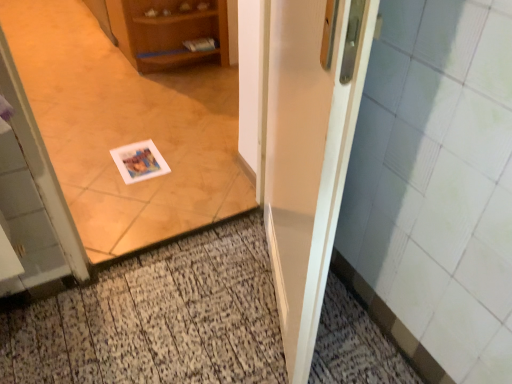
Find the location of a particular element. white paper at center is located at coordinates (126, 129).

Identify the location of white paper at center. (126, 129).

Visually, is white paper at center positioned to the left or to the right of white paper postcard at center?

Based on their positions, white paper at center is located to the right of white paper postcard at center.

Is white paper at center positioned with its back to white paper postcard at center?

Yes, white paper at center is facing away from white paper postcard at center.

Is there a large distance between white paper at center and white paper postcard at center?

white paper at center is actually quite close to white paper postcard at center.

Is white paper at center not within white paper postcard at center?

Yes, white paper at center is located beyond the bounds of white paper postcard at center.

Is the surface of white glossy door at center in direct contact with wooden cabinet at upper left?

No, white glossy door at center is not with wooden cabinet at upper left.

Which object is closer to the camera taking this photo, white glossy door at center or wooden cabinet at upper left?

white glossy door at center.

Who is smaller, white glossy door at center or wooden cabinet at upper left?

Smaller between the two is white glossy door at center.

Does point (296, 29) come closer to viewer compared to point (226, 56)?

Yes.

Are wooden cabinet at upper left and white paper postcard at center beside each other?

No, wooden cabinet at upper left is not making contact with white paper postcard at center.

From the image's perspective, which object appears higher, wooden cabinet at upper left or white paper postcard at center?

wooden cabinet at upper left, from the image's perspective.

Could you tell me if wooden cabinet at upper left is facing white paper postcard at center?

No, wooden cabinet at upper left is not oriented towards white paper postcard at center.

Consider the image. Is wooden cabinet at upper left wider or thinner than white paper postcard at center?

Clearly, wooden cabinet at upper left has more width compared to white paper postcard at center.

Who is smaller, wooden cabinet at upper left or white paper at center?

Smaller between the two is white paper at center.

Measure the distance between wooden cabinet at upper left and white paper at center.

wooden cabinet at upper left and white paper at center are 16.34 inches apart.

Could you tell me if wooden cabinet at upper left is facing white paper at center?

No, wooden cabinet at upper left does not turn towards white paper at center.

Between wooden cabinet at upper left and white paper at center, which one has larger width?

With larger width is wooden cabinet at upper left.

From the image's perspective, is white paper postcard at center below white glossy door at center?

Actually, white paper postcard at center appears above white glossy door at center in the image.

Is white paper postcard at center inside the boundaries of white glossy door at center, or outside?

white paper postcard at center exists outside the volume of white glossy door at center.

From a real-world perspective, between white paper postcard at center and white glossy door at center, who is vertically higher?

In real-world perspective, white glossy door at center is above.

Locate an element on the screen. door below the wooden cabinet at upper left (from the image's perspective) is located at coordinates (310, 152).

From a real-world perspective, is wooden cabinet at upper left positioned above or below white glossy door at center?

wooden cabinet at upper left is situated lower than white glossy door at center in the real world.

Is the surface of wooden cabinet at upper left in direct contact with white glossy door at center?

No, wooden cabinet at upper left is not in contact with white glossy door at center.

Is wooden cabinet at upper left wider than white glossy door at center?

Yes, wooden cabinet at upper left is wider than white glossy door at center.

I want to click on door above the white paper postcard at center (from a real-world perspective), so pos(310,152).

Looking at their sizes, would you say white glossy door at center is wider or thinner than white paper postcard at center?

white glossy door at center is thinner than white paper postcard at center.

Is the surface of white glossy door at center in direct contact with white paper postcard at center?

white glossy door at center is not next to white paper postcard at center, and they're not touching.

Is white glossy door at center looking in the opposite direction of white paper postcard at center?

white glossy door at center does not have its back to white paper postcard at center.

This screenshot has width=512, height=384. Find the location of `postcard that is above the white paper at center (from the image's perspective)`. postcard that is above the white paper at center (from the image's perspective) is located at coordinates (139, 161).

In order to click on door on the right of the wooden cabinet at upper left in this screenshot , I will do `click(310, 152)`.

Estimate the real-world distances between objects in this image. Which object is further from white paper postcard at center, white paper at center or wooden cabinet at upper left?

The object further to white paper postcard at center is wooden cabinet at upper left.

Looking at the image, which one is located closer to wooden cabinet at upper left, white paper postcard at center or white glossy door at center?

white paper postcard at center is positioned closer to the anchor wooden cabinet at upper left.

From the image, which object appears to be farther from white paper at center, wooden cabinet at upper left or white glossy door at center?

white glossy door at center lies further to white paper at center than the other object.

Considering their positions, is white glossy door at center positioned closer to white paper at center than wooden cabinet at upper left?

The object closer to white paper at center is wooden cabinet at upper left.

Based on their spatial positions, is white glossy door at center or wooden cabinet at upper left closer to white paper postcard at center?

wooden cabinet at upper left.

From the image, which object appears to be nearer to white glossy door at center, white paper at center or white paper postcard at center?

white paper at center lies closer to white glossy door at center than the other object.

In the scene shown: Considering their positions, is white paper postcard at center positioned closer to white glossy door at center than white paper at center?

white paper at center is closer to white glossy door at center.

When comparing their distances from wooden cabinet at upper left, does white paper postcard at center or white paper at center seem closer?

white paper at center is closer to wooden cabinet at upper left.

You are a GUI agent. You are given a task and a screenshot of the screen. Output one action in this format:
    pyautogui.click(x=<x>, y=<y>)
    Task: Click on the postcard between white glossy door at center and wooden cabinet at upper left from front to back
    
    Given the screenshot: What is the action you would take?
    pyautogui.click(x=139, y=161)

You are a GUI agent. You are given a task and a screenshot of the screen. Output one action in this format:
    pyautogui.click(x=<x>, y=<y>)
    Task: Click on the corridor between white glossy door at center and white paper postcard at center from front to back
    The width and height of the screenshot is (512, 384).
    Given the screenshot: What is the action you would take?
    coord(126,129)

The image size is (512, 384). Identify the location of postcard between wooden cabinet at upper left and white paper at center vertically. (139, 161).

Locate an element on the screen. The image size is (512, 384). corridor between white glossy door at center and wooden cabinet at upper left in the front-back direction is located at coordinates (126, 129).